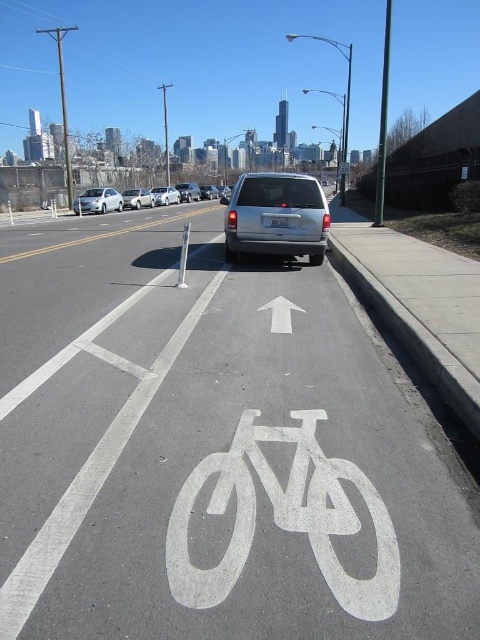
Question: Among these points, which one is farthest from the camera?

Choices:
 (A) (317, 508)
 (B) (213, 195)
 (C) (156, 195)
 (D) (323, 193)

Answer: (B)

Question: From the image, what is the correct spatial relationship of silver metallic van at center in relation to white matte sedan at left?

Choices:
 (A) above
 (B) below

Answer: (B)

Question: Where is white painted bicycle at center located in relation to silver metallic sedan at center in the image?

Choices:
 (A) below
 (B) above

Answer: (A)

Question: Is white painted bicycle lane at center below silver metallic sedan at center?

Choices:
 (A) yes
 (B) no

Answer: (A)

Question: Which of the following is the farthest from the observer?

Choices:
 (A) (35, 262)
 (B) (213, 186)
 (C) (183, 193)

Answer: (B)

Question: Which of the following is the closest to the observer?

Choices:
 (A) (108, 205)
 (B) (275, 241)
 (C) (157, 195)

Answer: (B)